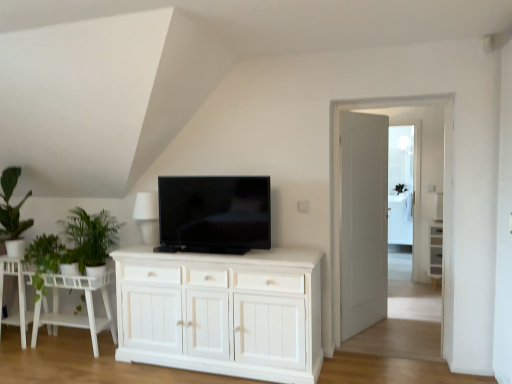
What are the coordinates of `free spot below white wooden door at center (from a real-world perspective)` in the screenshot? It's located at (366, 329).